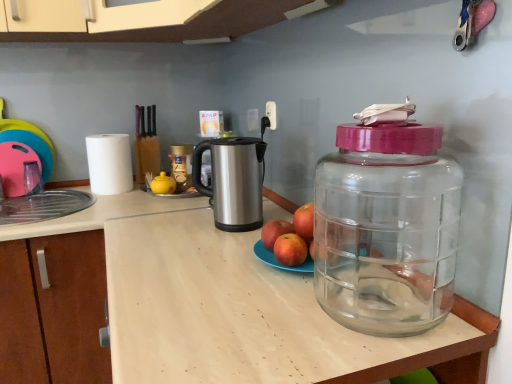
Find the location of a particular element. The width and height of the screenshot is (512, 384). vacant region in front of metallic gold jar at center, the 1th bottle from the back is located at coordinates (161, 201).